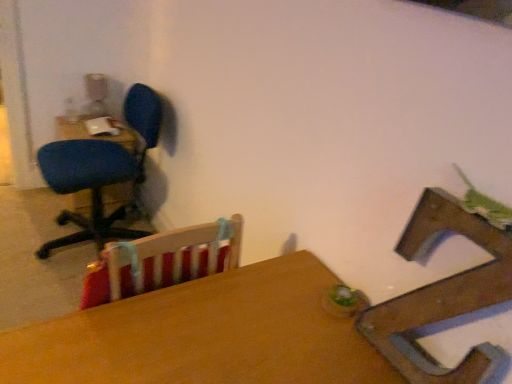
The width and height of the screenshot is (512, 384). I want to click on free spot above wooden chair at center, which is the second chair in left-to-right order (from a real-world perspective), so click(x=474, y=208).